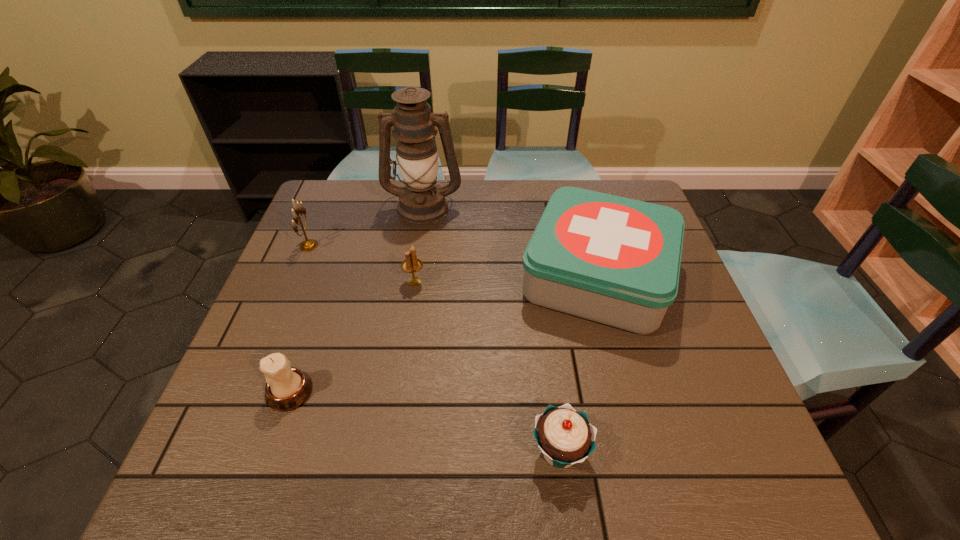
I want to click on vacant area at the left edge, so [321, 253].

In the image, there is a desktop. At what (x,y) coordinates should I click in order to perform the action: click on blank space at the right edge. Please return your answer as a coordinate pair (x, y). This screenshot has width=960, height=540. Looking at the image, I should click on (676, 328).

This screenshot has height=540, width=960. In the image, there is a desktop. In order to click on vacant space at the far left corner in this screenshot , I will do `click(317, 218)`.

Image resolution: width=960 pixels, height=540 pixels. I want to click on vacant region between the fifth farthest object and the tallest candle holder, so click(300, 319).

Find the location of a particular element. The height and width of the screenshot is (540, 960). free space between the second candle holder from left to right and the rightmost candle holder is located at coordinates (352, 336).

Where is `vacant space that is in between the farthest candle holder and the cupcake`? The height and width of the screenshot is (540, 960). vacant space that is in between the farthest candle holder and the cupcake is located at coordinates (434, 348).

Locate an element on the screen. unoccupied area between the second candle holder from left to right and the cupcake is located at coordinates (424, 421).

Locate an element on the screen. blank region between the rightmost candle holder and the nearest object is located at coordinates (487, 367).

This screenshot has width=960, height=540. I want to click on free spot between the second farthest candle holder and the nearest object, so click(x=487, y=367).

I want to click on free spot between the farthest candle holder and the first-aid kit, so click(453, 261).